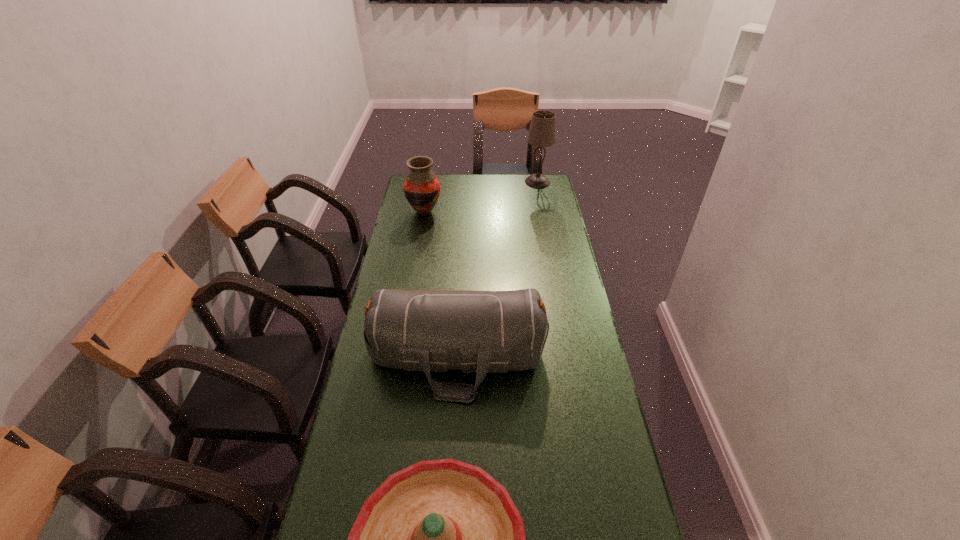
Find the location of a particular element. This screenshot has height=540, width=960. vase that is at the left edge is located at coordinates (421, 187).

Where is `duffel bag located in the left edge section of the desktop`? Image resolution: width=960 pixels, height=540 pixels. duffel bag located in the left edge section of the desktop is located at coordinates (485, 332).

Locate an element on the screen. This screenshot has height=540, width=960. lampshade located in the right edge section of the desktop is located at coordinates (542, 133).

Image resolution: width=960 pixels, height=540 pixels. What are the coordinates of `duffel bag at the right edge` in the screenshot? It's located at (485, 332).

Locate an element on the screen. object that is positioned at the far right corner is located at coordinates (542, 133).

The height and width of the screenshot is (540, 960). In the image, there is a desktop. What are the coordinates of `vacant space at the left edge` in the screenshot? It's located at (419, 244).

At what (x,y) coordinates should I click in order to perform the action: click on vacant space at the right edge. Please return your answer as a coordinate pair (x, y). This screenshot has width=960, height=540. Looking at the image, I should click on (611, 468).

Locate an element on the screen. free space between the tallest object and the second nearest object is located at coordinates (497, 269).

You are a GUI agent. You are given a task and a screenshot of the screen. Output one action in this format:
    pyautogui.click(x=<x>, y=<y>)
    Task: Click on the vacant region between the third farthest object and the second farthest object
    This screenshot has height=540, width=960.
    Given the screenshot: What is the action you would take?
    pyautogui.click(x=441, y=285)

At what (x,y) coordinates should I click in order to perform the action: click on free space between the vase and the duffel bag. Please return your answer as a coordinate pair (x, y). The height and width of the screenshot is (540, 960). Looking at the image, I should click on (441, 285).